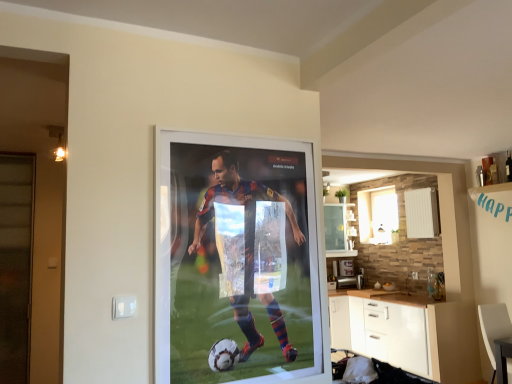
This screenshot has height=384, width=512. What do you see at coordinates (494, 328) in the screenshot? I see `white leather armchair at lower right` at bounding box center [494, 328].

Find the location of `white frosted glass window at upper right`. white frosted glass window at upper right is located at coordinates (377, 215).

What is the approximate width of white frosted glass window at upper right?

It is 4.24 inches.

You are a GUI agent. You are given a task and a screenshot of the screen. Output one action in this format:
    pyautogui.click(x=<x>, y=<y>)
    Task: Click on the white matte cabinet at lower right
    
    Given the screenshot: What is the action you would take?
    pyautogui.click(x=394, y=329)

How distant is white leather armchair at lower right from translucent glass screen door at left?

The distance of white leather armchair at lower right from translucent glass screen door at left is 4.32 meters.

How many degrees apart are the facing directions of white leather armchair at lower right and translucent glass screen door at left?

They differ by 6.62 degrees in their facing directions.

Are white leather armchair at lower right and translucent glass screen door at left far apart?

Yes, white leather armchair at lower right and translucent glass screen door at left are quite far apart.

From the picture: From the image's perspective, would you say white leather armchair at lower right is positioned over translucent glass screen door at left?

No, from the image's perspective, white leather armchair at lower right is not above translucent glass screen door at left.

Can you tell me how much white leather armchair at lower right and white frosted glass window at upper right differ in facing direction?

There is a 83.9-degree angle between the facing directions of white leather armchair at lower right and white frosted glass window at upper right.

Is white leather armchair at lower right looking in the opposite direction of white frosted glass window at upper right?

Yes, white frosted glass window at upper right is at the back of white leather armchair at lower right.

Can we say white leather armchair at lower right lies outside white frosted glass window at upper right?

Yes.

Is white leather armchair at lower right not near white frosted glass window at upper right?

That's right, there is a large distance between white leather armchair at lower right and white frosted glass window at upper right.

Between white matte cabinet at lower right and white frosted glass window at upper right, which one is positioned in front?

Positioned in front is white matte cabinet at lower right.

Which of these two, white matte cabinet at lower right or white frosted glass window at upper right, is smaller?

Smaller between the two is white frosted glass window at upper right.

From the image's perspective, between white matte cabinet at lower right and white frosted glass window at upper right, which one is located above?

white frosted glass window at upper right.

Could you tell me if white matte cabinet at lower right is facing white frosted glass window at upper right?

No, white matte cabinet at lower right is not turned towards white frosted glass window at upper right.

Which object is more forward, white frosted glass window at upper right or white matte cabinet at lower right?

white matte cabinet at lower right is more forward.

Is white frosted glass window at upper right touching white matte cabinet at lower right?

There is a gap between white frosted glass window at upper right and white matte cabinet at lower right.

Considering the sizes of objects white frosted glass window at upper right and white matte cabinet at lower right in the image provided, who is bigger, white frosted glass window at upper right or white matte cabinet at lower right?

Bigger between the two is white matte cabinet at lower right.

Does white frosted glass window at upper right appear on the right side of white matte cabinet at lower right?

Correct, you'll find white frosted glass window at upper right to the right of white matte cabinet at lower right.

Looking at this image, can you confirm if white leather armchair at lower right is shorter than white matte cabinet at lower right?

Indeed, white leather armchair at lower right has a lesser height compared to white matte cabinet at lower right.

Is white leather armchair at lower right far away from white matte cabinet at lower right?

Actually, white leather armchair at lower right and white matte cabinet at lower right are a little close together.

In the scene shown: Between white leather armchair at lower right and white matte cabinet at lower right, which one has larger width?

With larger width is white matte cabinet at lower right.

Considering the positions of points (488, 310) and (340, 326), is point (488, 310) farther from camera compared to point (340, 326)?

That is False.

How different are the orientations of translucent glass screen door at left and white leather armchair at lower right in degrees?

They differ by 6.62 degrees in their facing directions.

From a real-world perspective, does translucent glass screen door at left sit lower than white leather armchair at lower right?

No, from a real-world perspective, translucent glass screen door at left is not under white leather armchair at lower right.

Considering the positions of points (25, 199) and (485, 309), is point (25, 199) farther from camera compared to point (485, 309)?

That is False.

Considering the relative sizes of translucent glass screen door at left and white leather armchair at lower right in the image provided, is translucent glass screen door at left bigger than white leather armchair at lower right?

Actually, translucent glass screen door at left might be smaller than white leather armchair at lower right.

Considering the sizes of translucent glass screen door at left and white frosted glass window at upper right in the image, is translucent glass screen door at left wider or thinner than white frosted glass window at upper right?

translucent glass screen door at left is wider than white frosted glass window at upper right.

From the picture: Which of these two, translucent glass screen door at left or white frosted glass window at upper right, stands shorter?

With less height is white frosted glass window at upper right.

Choose the correct answer: Is translucent glass screen door at left inside white frosted glass window at upper right or outside it?

translucent glass screen door at left is not inside white frosted glass window at upper right, it's outside.

Considering the relative sizes of translucent glass screen door at left and white frosted glass window at upper right in the image provided, is translucent glass screen door at left bigger than white frosted glass window at upper right?

Indeed, translucent glass screen door at left has a larger size compared to white frosted glass window at upper right.

The width and height of the screenshot is (512, 384). I want to click on armchair behind the translucent glass screen door at left, so click(494, 328).

The image size is (512, 384). What are the coordinates of `armchair below the white frosted glass window at upper right (from the image's perspective)` in the screenshot? It's located at (494, 328).

From the image, which object appears to be nearer to white frosted glass window at upper right, white matte cabinet at lower right or white leather armchair at lower right?

white matte cabinet at lower right lies closer to white frosted glass window at upper right than the other object.

Estimate the real-world distances between objects in this image. Which object is further from white matte cabinet at lower right, white frosted glass window at upper right or white leather armchair at lower right?

Based on the image, white frosted glass window at upper right appears to be further to white matte cabinet at lower right.

Considering their positions, is white frosted glass window at upper right positioned closer to translucent glass screen door at left than white leather armchair at lower right?

white leather armchair at lower right lies closer to translucent glass screen door at left than the other object.

Estimate the real-world distances between objects in this image. Which object is closer to white leather armchair at lower right, white frosted glass window at upper right or white matte cabinet at lower right?

The object closer to white leather armchair at lower right is white matte cabinet at lower right.

Estimate the real-world distances between objects in this image. Which object is further from white matte cabinet at lower right, white frosted glass window at upper right or translucent glass screen door at left?

translucent glass screen door at left is further to white matte cabinet at lower right.

Based on their spatial positions, is white frosted glass window at upper right or translucent glass screen door at left closer to white leather armchair at lower right?

white frosted glass window at upper right.

Looking at the image, which one is located closer to translucent glass screen door at left, white frosted glass window at upper right or white matte cabinet at lower right?

white matte cabinet at lower right is closer to translucent glass screen door at left.

From the image, which object appears to be farther from white frosted glass window at upper right, translucent glass screen door at left or white matte cabinet at lower right?

The object further to white frosted glass window at upper right is translucent glass screen door at left.

Image resolution: width=512 pixels, height=384 pixels. What are the coordinates of `cabinetry between translucent glass screen door at left and white frosted glass window at upper right` in the screenshot? It's located at (394, 329).

You are a GUI agent. You are given a task and a screenshot of the screen. Output one action in this format:
    pyautogui.click(x=<x>, y=<y>)
    Task: Click on the window between translucent glass screen door at left and white leather armchair at lower right
    The width and height of the screenshot is (512, 384).
    Given the screenshot: What is the action you would take?
    pyautogui.click(x=377, y=215)

Where is `cabinetry located between white leather armchair at lower right and white frosted glass window at upper right in the depth direction`? cabinetry located between white leather armchair at lower right and white frosted glass window at upper right in the depth direction is located at coordinates (394, 329).

What are the coordinates of `cabinetry between translucent glass screen door at left and white leather armchair at lower right in the horizontal direction` in the screenshot? It's located at pyautogui.click(x=394, y=329).